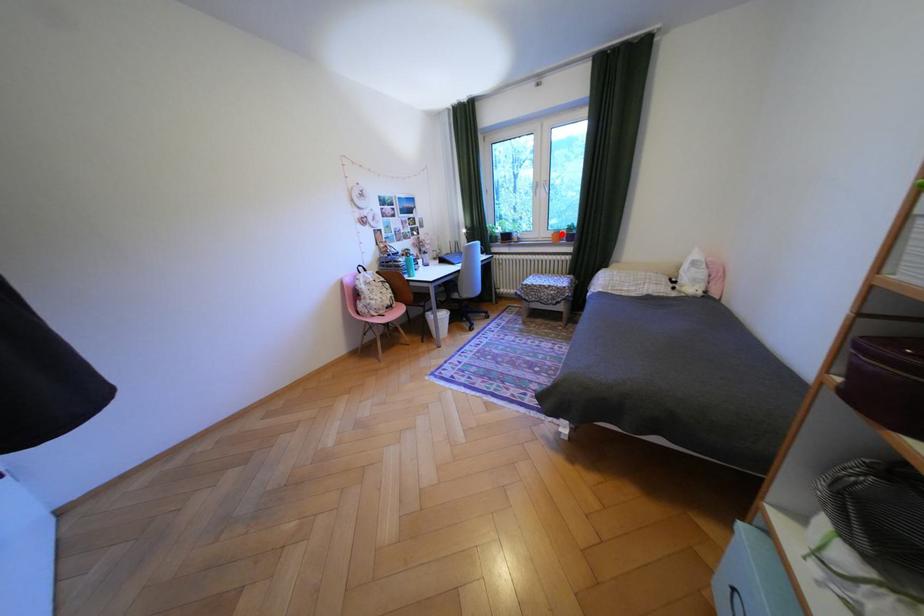
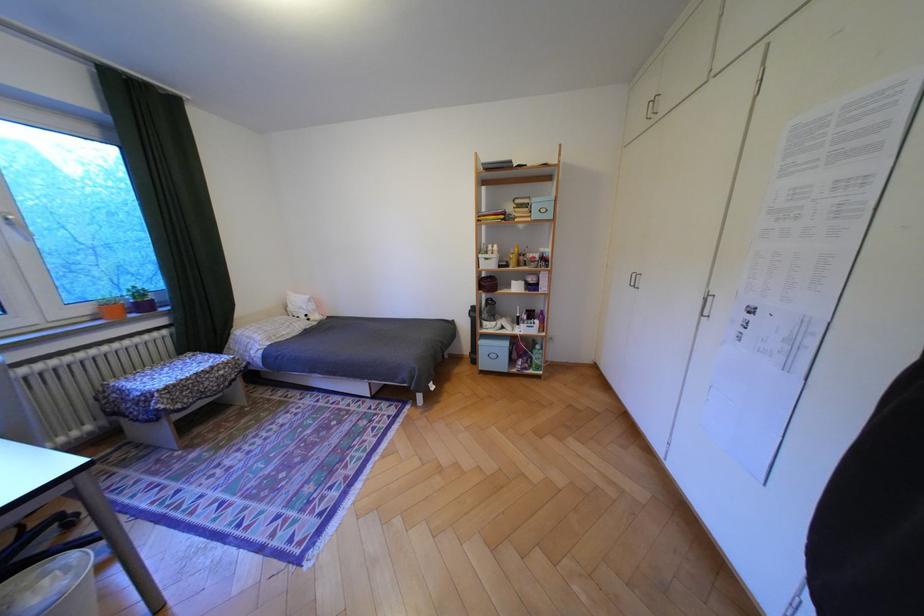
Question: I am providing you with two images of the same scene from different viewpoints. Image1 has a red point marked. In image2, the corresponding 3D location appears at what relative position? Reply with the corresponding letter.

Choices:
 (A) Closer
 (B) Farther

Answer: (B)